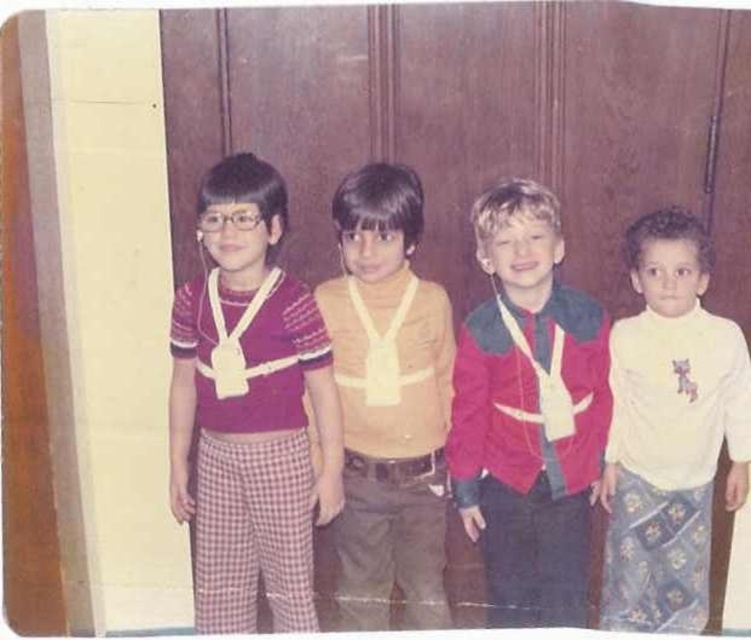
Between point (372, 408) and point (725, 433), which one is positioned in front?

Positioned in front is point (372, 408).

Who is lower down, matte yellow shirt at center or white soft turtleneck at right?

Positioned lower is white soft turtleneck at right.

Is point (379, 228) behind point (737, 428)?

No, it is not.

Image resolution: width=751 pixels, height=640 pixels. I want to click on matte yellow shirt at center, so click(388, 403).

Who is lower down, matte yellow shirt at center or matte white scarf at center?

matte yellow shirt at center is below.

Does matte yellow shirt at center have a greater width compared to matte white scarf at center?

Correct, the width of matte yellow shirt at center exceeds that of matte white scarf at center.

Who is more distant from viewer, (430,547) or (523,285)?

Point (430,547)

Identify the location of matte yellow shirt at center. Image resolution: width=751 pixels, height=640 pixels. (388, 403).

Is matte red sweater at left positioned before matte red jacket at center?

Yes, matte red sweater at left is closer to the viewer.

Between point (201, 342) and point (584, 310), which one is positioned behind?

Point (584, 310)

The image size is (751, 640). Describe the element at coordinates (249, 413) in the screenshot. I see `matte red sweater at left` at that location.

Identify the location of matte red sweater at left. The height and width of the screenshot is (640, 751). (249, 413).